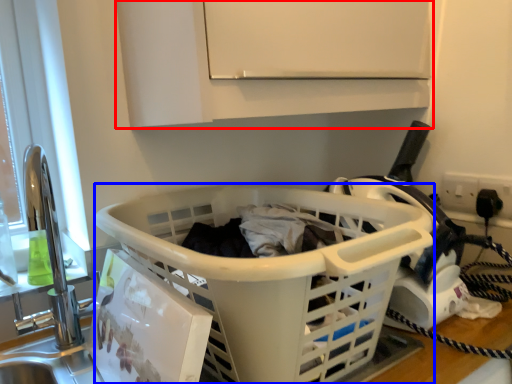
Question: Among these objects, which one is farthest to the camera, cabinetry (highlighted by a red box) or basket (highlighted by a blue box)?

Choices:
 (A) cabinetry
 (B) basket

Answer: (A)